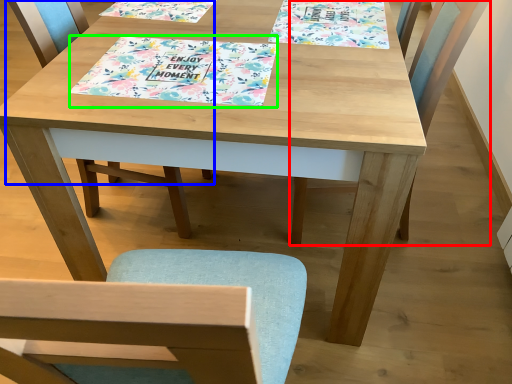
Question: Which is nearer to the chair (highlighted by a red box)? chair (highlighted by a blue box) or tablecloth (highlighted by a green box).

Choices:
 (A) chair
 (B) tablecloth

Answer: (B)